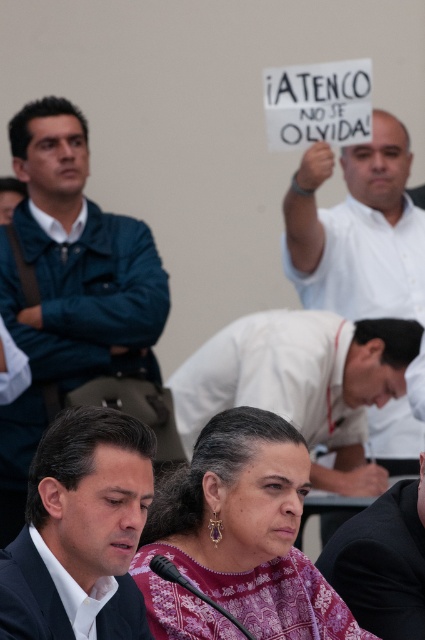
Looking at this image, can you confirm if purple printed blouse at center is wider than black fabric shirt at lower center?

Yes, purple printed blouse at center is wider than black fabric shirt at lower center.

Is point (175, 508) positioned after point (371, 577)?

No, it is not.

Measure the distance between point (229, 608) and camera.

Point (229, 608) is 11.12 feet away from camera.

Identify the location of purple printed blouse at center. The image size is (425, 640). (238, 538).

Who is more forward, [343,170] or [413,556]?

Point [413,556] is in front.

Who is more forward, (x=418, y=440) or (x=343, y=536)?

Point (x=343, y=536) is in front.

Find the location of a particular element. white matte shirt at upper right is located at coordinates (357, 228).

Which of these two, matte black man at lower left or black fabric shirt at lower center, stands shorter?

Standing shorter between the two is black fabric shirt at lower center.

Between matte black man at lower left and black fabric shirt at lower center, which one appears on the right side from the viewer's perspective?

Positioned to the right is black fabric shirt at lower center.

Does point (17, 625) lie in front of point (371, 550)?

Yes.

What are the coordinates of `matte black man at lower left` in the screenshot? It's located at (81, 525).